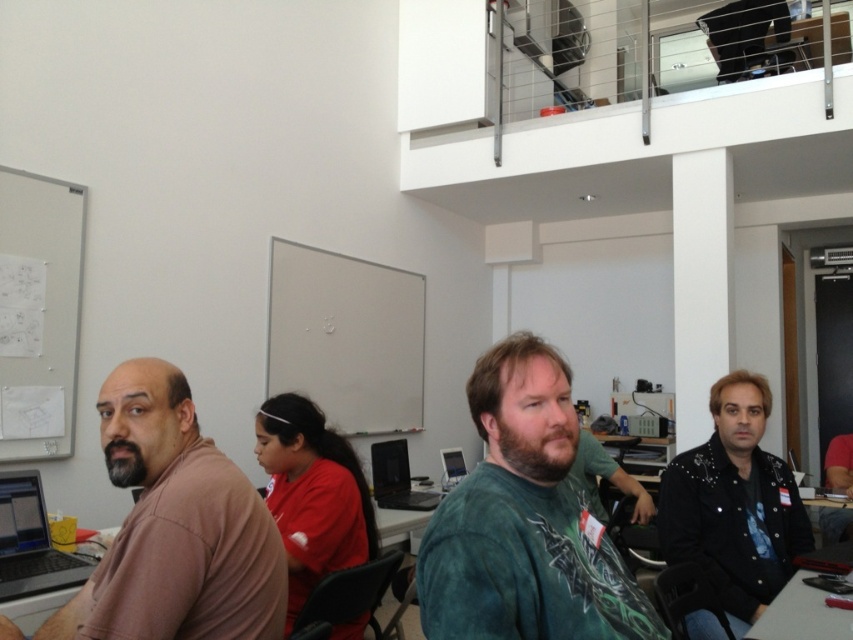
Between matte red shirt at center and silver metallic laptop at left, which one has more height?

With more height is matte red shirt at center.

Is point (338, 531) closer to camera compared to point (16, 595)?

That is False.

The height and width of the screenshot is (640, 853). Identify the location of matte red shirt at center. (312, 493).

Between black studded leather jacket at lower right and black plastic laptop at center, which one is positioned lower?

black plastic laptop at center is below.

Between point (721, 508) and point (383, 452), which one is positioned in front?

Point (721, 508)

Locate an element on the screen. This screenshot has height=640, width=853. black studded leather jacket at lower right is located at coordinates (734, 504).

Between teal matte shirt at center and matte black monitor at center, which one appears on the right side from the viewer's perspective?

Positioned to the right is teal matte shirt at center.

Who is more distant from viewer, (x=527, y=394) or (x=447, y=456)?

The point (x=447, y=456) is more distant.

Is point (469, 538) behind point (453, 467)?

No, it is in front of (453, 467).

Find the location of a particular element. The height and width of the screenshot is (640, 853). teal matte shirt at center is located at coordinates (525, 520).